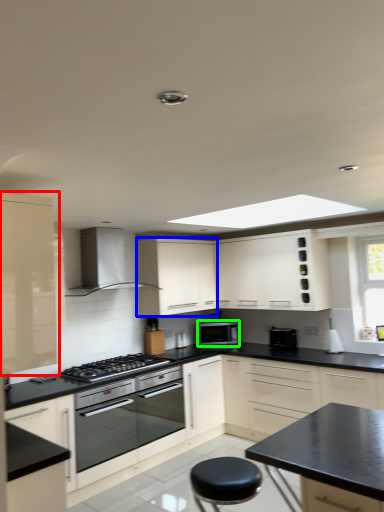
Question: Which is farther away from cabinetry (highlighted by a red box)? cabinetry (highlighted by a blue box) or microwave oven (highlighted by a green box)?

Choices:
 (A) cabinetry
 (B) microwave oven

Answer: (B)